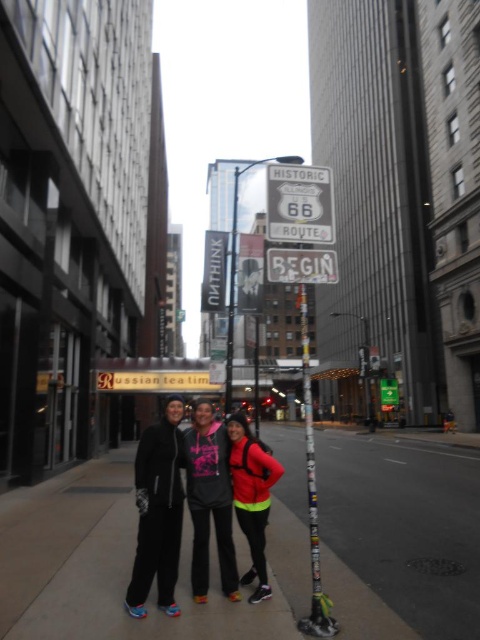
Is point (176, 497) farther from camera compared to point (282, 269)?

Yes, point (176, 497) is behind point (282, 269).

Which is below, black fleece jacket at center or white plastic begin sign at center?

Positioned lower is black fleece jacket at center.

Image resolution: width=480 pixels, height=640 pixels. I want to click on black fleece jacket at center, so click(x=157, y=512).

Locate an element on the screen. black fleece jacket at center is located at coordinates (157, 512).

Who is positioned more to the left, black fleece jacket at center or black matte jacket at center?

black fleece jacket at center is more to the left.

Where is `black fleece jacket at center`? black fleece jacket at center is located at coordinates (157, 512).

The image size is (480, 640). Find the location of `black fleece jacket at center`. black fleece jacket at center is located at coordinates (157, 512).

Between black fleece jacket at center and neon yellow fabric jacket at center, which one appears on the left side from the viewer's perspective?

From the viewer's perspective, black fleece jacket at center appears more on the left side.

The width and height of the screenshot is (480, 640). Describe the element at coordinates (157, 512) in the screenshot. I see `black fleece jacket at center` at that location.

Identify the location of black fleece jacket at center. (157, 512).